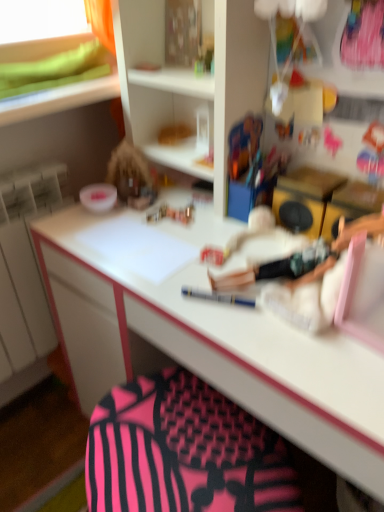
Question: Is white glossy bowl at upper left a part of pink fabric swivel chair at lower center?

Choices:
 (A) yes
 (B) no

Answer: (B)

Question: From a real-world perspective, is pink fabric swivel chair at lower center physically below white glossy bowl at upper left?

Choices:
 (A) yes
 (B) no

Answer: (A)

Question: From a real-world perspective, is pink fabric swivel chair at lower center on top of white glossy bowl at upper left?

Choices:
 (A) no
 (B) yes

Answer: (A)

Question: Can you confirm if pink fabric swivel chair at lower center is positioned to the left of white glossy bowl at upper left?

Choices:
 (A) no
 (B) yes

Answer: (A)

Question: Is pink fabric swivel chair at lower center shorter than white glossy bowl at upper left?

Choices:
 (A) no
 (B) yes

Answer: (A)

Question: Does pink fabric swivel chair at lower center have a greater height compared to white glossy bowl at upper left?

Choices:
 (A) no
 (B) yes

Answer: (B)

Question: From the image's perspective, is white glossy bowl at upper left located beneath pink fabric swivel chair at lower center?

Choices:
 (A) yes
 (B) no

Answer: (B)

Question: Does white glossy bowl at upper left have a smaller size compared to pink fabric swivel chair at lower center?

Choices:
 (A) no
 (B) yes

Answer: (B)

Question: Is white glossy bowl at upper left looking in the opposite direction of pink fabric swivel chair at lower center?

Choices:
 (A) yes
 (B) no

Answer: (B)

Question: From the image's perspective, is white glossy bowl at upper left above pink fabric swivel chair at lower center?

Choices:
 (A) no
 (B) yes

Answer: (B)

Question: Could you tell me if white glossy bowl at upper left is facing pink fabric swivel chair at lower center?

Choices:
 (A) yes
 (B) no

Answer: (B)

Question: Does white glossy bowl at upper left come in front of pink fabric swivel chair at lower center?

Choices:
 (A) no
 (B) yes

Answer: (A)

Question: Visually, is white glossy bowl at upper left positioned to the left or to the right of pink fabric swivel chair at lower center?

Choices:
 (A) left
 (B) right

Answer: (A)